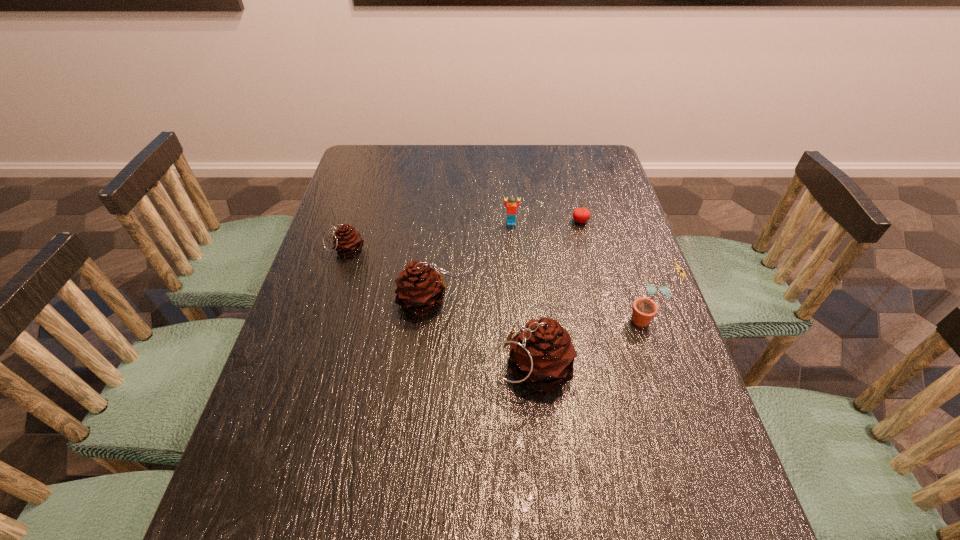
You are a GUI agent. You are given a task and a screenshot of the screen. Output one action in this format:
    pyautogui.click(x=<x>, y=<y>)
    Task: Click on the vacant region between the Lego and the cherry
    The height and width of the screenshot is (540, 960).
    Given the screenshot: What is the action you would take?
    pyautogui.click(x=545, y=222)

At what (x,y) coordinates should I click in order to perform the action: click on vacant area that lies between the shortest pinecone and the Lego. Please return your answer as a coordinate pair (x, y). Image resolution: width=960 pixels, height=540 pixels. Looking at the image, I should click on (428, 237).

Identify the location of free spot between the fifth object from left to right and the third farthest object. The image size is (960, 540). (464, 235).

You are a GUI agent. You are given a task and a screenshot of the screen. Output one action in this format:
    pyautogui.click(x=<x>, y=<y>)
    Task: Click on the free spot between the Lego and the cherry
    The image size is (960, 540).
    Given the screenshot: What is the action you would take?
    pyautogui.click(x=545, y=222)

This screenshot has width=960, height=540. In order to click on unoccupied area between the sunflower and the Lego in this screenshot , I will do `click(579, 271)`.

The height and width of the screenshot is (540, 960). I want to click on vacant area that lies between the rightmost pinecone and the Lego, so click(x=521, y=296).

Where is `the closest object to the second object from right to left`? The height and width of the screenshot is (540, 960). the closest object to the second object from right to left is located at coordinates (511, 207).

Select which object appears as the second closest to the Lego. Please provide its 2D coordinates. Your answer should be formatted as a tuple, i.e. [(x, y)], where the tuple contains the x and y coordinates of a point satisfying the conditions above.

[(419, 291)]

The width and height of the screenshot is (960, 540). I want to click on pinecone identified as the second closest to the fifth object from left to right, so click(x=541, y=356).

Locate which pinecone is the second closest to the Lego. Please provide its 2D coordinates. Your answer should be formatted as a tuple, i.e. [(x, y)], where the tuple contains the x and y coordinates of a point satisfying the conditions above.

[(347, 241)]